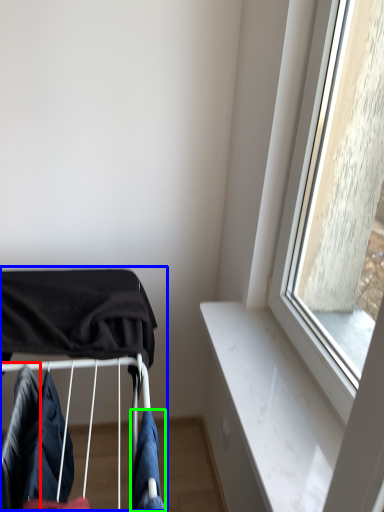
Question: Which is farther away from clothing (highlighted by a red box)? baby carriage (highlighted by a blue box) or clothing (highlighted by a green box)?

Choices:
 (A) baby carriage
 (B) clothing

Answer: (B)